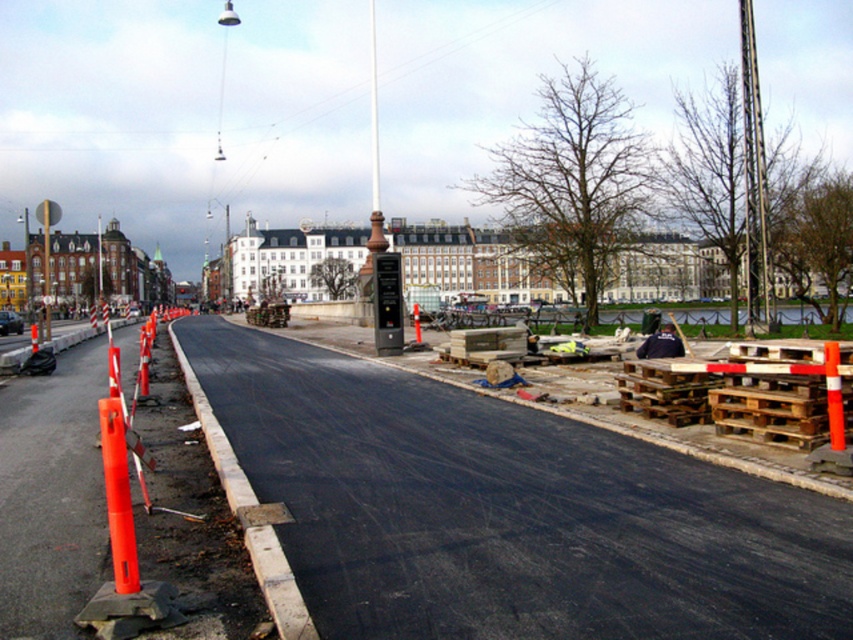
Question: Is metallic pole at upper right thinner than dark blue fabric at center?

Choices:
 (A) no
 (B) yes

Answer: (A)

Question: Which point is farther from the camera taking this photo?

Choices:
 (A) (646, 355)
 (B) (636, 381)
 (C) (416, 337)

Answer: (C)

Question: Which object appears farthest from the camera in this image?

Choices:
 (A) orange plastic traffic cone at center-left
 (B) dark blue fabric at center
 (C) brushed metal pole at center
 (D) metallic pole at upper right

Answer: (A)

Question: Can you confirm if wooden pallets at right is smaller than dark blue fabric at center?

Choices:
 (A) no
 (B) yes

Answer: (B)

Question: Which is nearer to the brushed metal pole at center?

Choices:
 (A) wooden pallets at right
 (B) metallic pole at upper right
 (C) orange plastic traffic cone at center-left
 (D) dark blue fabric at center

Answer: (A)

Question: Is dark blue fabric at center above orange plastic traffic cone at center-left?

Choices:
 (A) no
 (B) yes

Answer: (A)